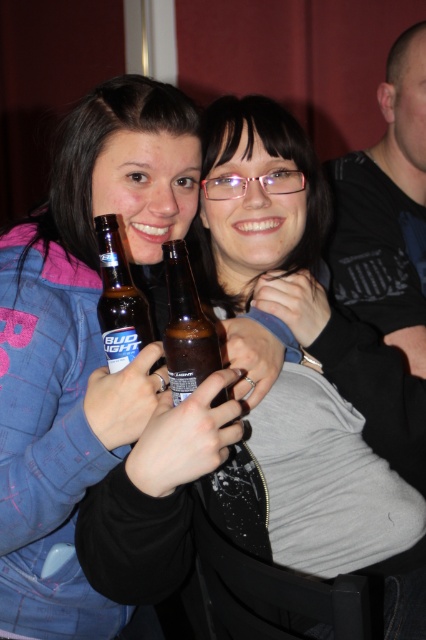
Describe the element at coordinates (77, 349) in the screenshot. I see `matte black jacket at center` at that location.

Does matte black jacket at center have a greater width compared to black cotton shirt at upper right?

No.

This screenshot has width=426, height=640. In order to click on matte black jacket at center in this screenshot , I will do `click(77, 349)`.

Locate an element on the screen. This screenshot has width=426, height=640. matte black jacket at center is located at coordinates (77, 349).

Who is lower down, matte black jacket at center or matte brown bottle at center?

matte black jacket at center

Can you confirm if matte black jacket at center is positioned below matte brown bottle at center?

Yes, matte black jacket at center is below matte brown bottle at center.

Is point (43, 573) in front of point (112, 232)?

No, (43, 573) is behind (112, 232).

This screenshot has height=640, width=426. Find the location of `matte black jacket at center`. matte black jacket at center is located at coordinates 77,349.

Is black cotton shirt at upper right to the right of brown glass bottle at center from the viewer's perspective?

Correct, you'll find black cotton shirt at upper right to the right of brown glass bottle at center.

Can you confirm if black cotton shirt at upper right is wider than brown glass bottle at center?

Yes, black cotton shirt at upper right is wider than brown glass bottle at center.

Is point (414, 308) closer to viewer compared to point (193, 339)?

No.

The width and height of the screenshot is (426, 640). Identify the location of black cotton shirt at upper right. (388, 211).